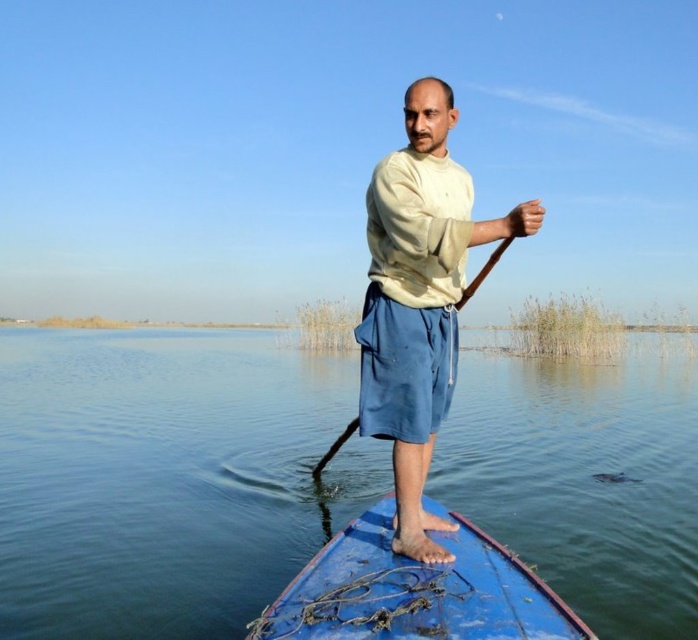
Question: Based on their relative distances, which object is nearer to the blue wooden canoe at center?

Choices:
 (A) beige cotton shirt at center
 (B) blue water at center
 (C) wooden paddle at center

Answer: (A)

Question: Observing the image, what is the correct spatial positioning of beige cotton shirt at center in reference to blue wooden canoe at center?

Choices:
 (A) above
 (B) below

Answer: (A)

Question: Considering the real-world distances, which object is closest to the wooden paddle at center?

Choices:
 (A) beige cotton shirt at center
 (B) blue wooden canoe at center
 (C) blue water at center

Answer: (B)

Question: Is beige cotton shirt at center positioned behind wooden paddle at center?

Choices:
 (A) no
 (B) yes

Answer: (A)

Question: Which point is farther to the camera?

Choices:
 (A) blue wooden canoe at center
 (B) wooden paddle at center
 (C) beige cotton shirt at center

Answer: (B)

Question: Is blue water at center bigger than wooden paddle at center?

Choices:
 (A) no
 (B) yes

Answer: (B)